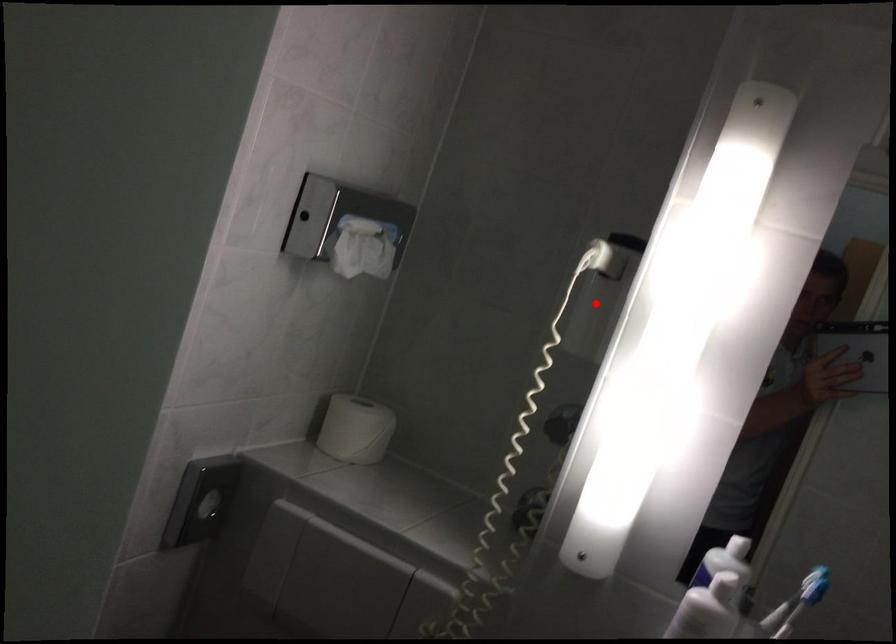
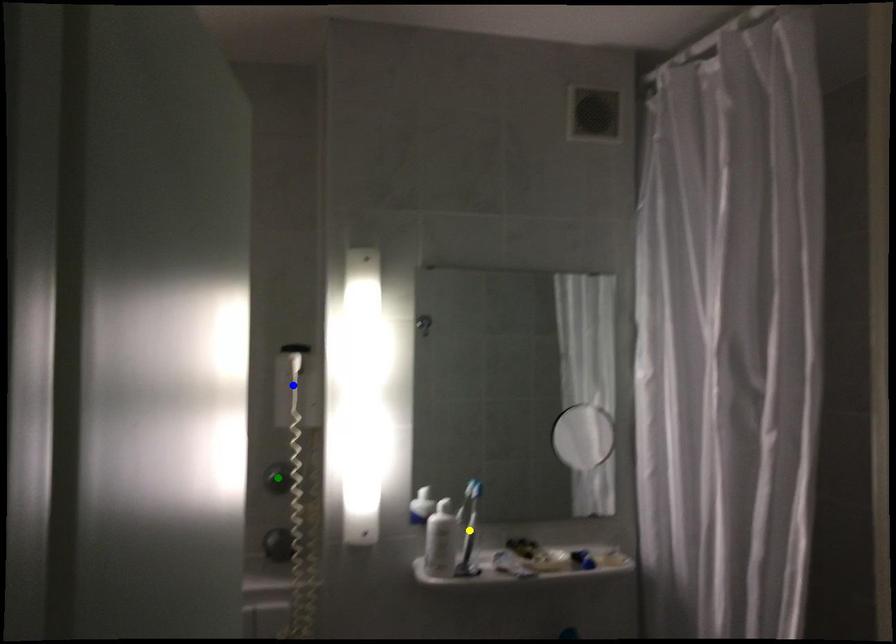
Question: I am providing you with two images of the same scene from different viewpoints. A red point is marked on the first image. You are given multiple points on the second image. Which mark in image 2 goes with the point in image 1?

Choices:
 (A) green point
 (B) yellow point
 (C) blue point

Answer: (C)